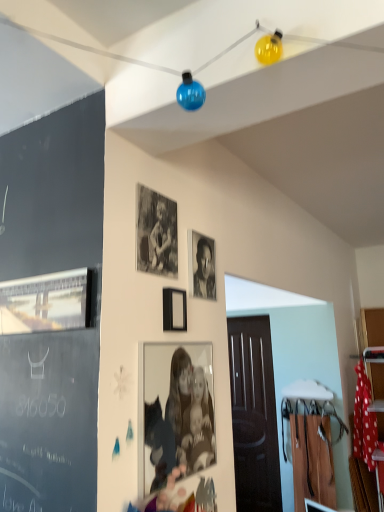
How much space does metallic silver picture frame at left, which is the first picture frame in left-to-right order, occupy horizontally?

1.21 inches.

Locate an element on the screen. metallic silver picture frame at left, which appears as the fourth picture frame when viewed from the right is located at coordinates (46, 302).

What do you see at coordinates (174, 310) in the screenshot? This screenshot has height=512, width=384. I see `black matte picture frame at center, positioned as the 3th picture frame in top-to-bottom order` at bounding box center [174, 310].

This screenshot has height=512, width=384. What are the coordinates of `metallic silver picture frame at left, acting as the 3th picture frame starting from the bottom` in the screenshot? It's located at (46, 302).

Is black and white photograph at center closer to the viewer compared to metallic silver picture frame at left, acting as the 3th picture frame starting from the bottom?

No, it is not.

Is black and white photograph at center oriented towards metallic silver picture frame at left, which appears as the fourth picture frame when viewed from the right?

No, black and white photograph at center is not facing towards metallic silver picture frame at left, which appears as the fourth picture frame when viewed from the right.

From a real-world perspective, is black and white photograph at center beneath metallic silver picture frame at left, acting as the 3th picture frame starting from the bottom?

No, from a real-world perspective, black and white photograph at center is not under metallic silver picture frame at left, acting as the 3th picture frame starting from the bottom.

Considering the positions of point (206, 287) and point (9, 306), is point (206, 287) closer or farther from the camera than point (9, 306)?

Point (206, 287) is positioned farther from the camera compared to point (9, 306).

Can you tell me how much black matte picture frame at center, positioned as the 3th picture frame in top-to-bottom order, and matte black photo frame at center, the first picture frame in the bottom-to-top sequence, differ in facing direction?

0.817 degrees.

Which is more to the right, black matte picture frame at center, positioned as the 3th picture frame in top-to-bottom order, or matte black photo frame at center, the fourth picture frame in the top-to-bottom sequence?

matte black photo frame at center, the fourth picture frame in the top-to-bottom sequence, is more to the right.

Is black matte picture frame at center, positioned as the 3th picture frame in top-to-bottom order, in front of or behind matte black photo frame at center, which appears as the fourth picture frame when viewed from the left, in the image?

black matte picture frame at center, positioned as the 3th picture frame in top-to-bottom order, is positioned farther from the viewer than matte black photo frame at center, which appears as the fourth picture frame when viewed from the left.

Considering the points (180, 430) and (176, 307), which point is behind, point (180, 430) or point (176, 307)?

The point (176, 307) is more distant.

Measure the distance between matte black photo frame at center, which appears as the fourth picture frame when viewed from the left, and black matte picture frame at center, positioned as the second picture frame in bottom-to-top order.

matte black photo frame at center, which appears as the fourth picture frame when viewed from the left, is 11.56 inches from black matte picture frame at center, positioned as the second picture frame in bottom-to-top order.

From the image's perspective, relative to black matte picture frame at center, positioned as the second picture frame in bottom-to-top order, is matte black photo frame at center, acting as the first picture frame starting from the right, above or below?

Based on their image positions, matte black photo frame at center, acting as the first picture frame starting from the right, is located beneath black matte picture frame at center, positioned as the second picture frame in bottom-to-top order.

Is black matte photo frame at upper center, which ranks as the third picture frame in right-to-left order, to the right of black matte picture frame at center, which is the 3th picture frame in left-to-right order, from the viewer's perspective?

No, black matte photo frame at upper center, which ranks as the third picture frame in right-to-left order, is not to the right of black matte picture frame at center, which is the 3th picture frame in left-to-right order.

Relative to black matte picture frame at center, positioned as the second picture frame in bottom-to-top order, is black matte photo frame at upper center, which is counted as the 2th picture frame, starting from the left, in front or behind?

black matte photo frame at upper center, which is counted as the 2th picture frame, starting from the left, is positioned closer to the viewer than black matte picture frame at center, positioned as the second picture frame in bottom-to-top order.

Is black matte photo frame at upper center, which ranks as the third picture frame in right-to-left order, not inside black matte picture frame at center, which is the 3th picture frame in left-to-right order?

Yes, black matte photo frame at upper center, which ranks as the third picture frame in right-to-left order, is located beyond the bounds of black matte picture frame at center, which is the 3th picture frame in left-to-right order.

From a real-world perspective, is black matte photo frame at upper center, which is the 4th picture frame from bottom to top, over black matte picture frame at center, which ranks as the second picture frame in right-to-left order?

Yes.

Considering the sizes of objects matte black photo frame at center, the fourth picture frame in the top-to-bottom sequence, and black matte photo frame at upper center, which is the 4th picture frame from bottom to top, in the image provided, who is bigger, matte black photo frame at center, the fourth picture frame in the top-to-bottom sequence, or black matte photo frame at upper center, which is the 4th picture frame from bottom to top,?

matte black photo frame at center, the fourth picture frame in the top-to-bottom sequence.

From the matte black photo frame at center, acting as the first picture frame starting from the right, count 1st picture frames backward and point to it. Please provide its 2D coordinates.

[(156, 233)]

Looking at this image, relative to black matte photo frame at upper center, which ranks as the third picture frame in right-to-left order, is matte black photo frame at center, which appears as the fourth picture frame when viewed from the left, in front or behind?

matte black photo frame at center, which appears as the fourth picture frame when viewed from the left, is in front of black matte photo frame at upper center, which ranks as the third picture frame in right-to-left order.

Is matte black photo frame at center, acting as the first picture frame starting from the right, positioned with its back to metallic silver picture frame at left, which is the first picture frame in left-to-right order?

matte black photo frame at center, acting as the first picture frame starting from the right, does not have its back to metallic silver picture frame at left, which is the first picture frame in left-to-right order.

Can metallic silver picture frame at left, acting as the 3th picture frame starting from the bottom, be found inside matte black photo frame at center, acting as the first picture frame starting from the right?

That's incorrect, metallic silver picture frame at left, acting as the 3th picture frame starting from the bottom, is not inside matte black photo frame at center, acting as the first picture frame starting from the right.

From the image's perspective, is matte black photo frame at center, the first picture frame in the bottom-to-top sequence, above metallic silver picture frame at left, which is the first picture frame in left-to-right order?

Incorrect, from the image's perspective, matte black photo frame at center, the first picture frame in the bottom-to-top sequence, is lower than metallic silver picture frame at left, which is the first picture frame in left-to-right order.

How many degrees apart are the facing directions of matte black photo frame at center, the first picture frame in the bottom-to-top sequence, and metallic silver picture frame at left, which appears as the fourth picture frame when viewed from the right?

The angular difference between matte black photo frame at center, the first picture frame in the bottom-to-top sequence, and metallic silver picture frame at left, which appears as the fourth picture frame when viewed from the right, is 90.6 degrees.

How different are the orientations of black and white photograph at center and black matte photo frame at upper center, the 1th picture frame viewed from the top, in degrees?

0.965 degrees.

Which object is wider, black and white photograph at center or black matte photo frame at upper center, which ranks as the third picture frame in right-to-left order?

Wider between the two is black and white photograph at center.

Which is farther from the camera, (206, 268) or (172, 250)?

The point (206, 268) is farther.

Where is `person directly beneath the black matte photo frame at upper center, which ranks as the third picture frame in right-to-left order (from a real-world perspective)`? The image size is (384, 512). person directly beneath the black matte photo frame at upper center, which ranks as the third picture frame in right-to-left order (from a real-world perspective) is located at coordinates (204, 271).

There is a black and white photograph at center. Identify the location of the 1st picture frame below it (from the image's perspective). Image resolution: width=384 pixels, height=512 pixels. (46, 302).

The width and height of the screenshot is (384, 512). Identify the location of picture frame that is the 1st object located above the matte black photo frame at center, acting as the first picture frame starting from the right (from the image's perspective). (174, 310).

In the scene shown: From the image, which object appears to be nearer to black matte photo frame at upper center, which is the 4th picture frame from bottom to top, black and white photograph at center or black matte picture frame at center, which is the 3th picture frame in left-to-right order?

black matte picture frame at center, which is the 3th picture frame in left-to-right order, lies closer to black matte photo frame at upper center, which is the 4th picture frame from bottom to top, than the other object.

Looking at the image, which one is located further to matte black photo frame at center, the first picture frame in the bottom-to-top sequence, black matte picture frame at center, which ranks as the second picture frame in right-to-left order, or metallic silver picture frame at left, which is the 2th picture frame in top-to-bottom order?

Among the two, metallic silver picture frame at left, which is the 2th picture frame in top-to-bottom order, is located further to matte black photo frame at center, the first picture frame in the bottom-to-top sequence.

Estimate the real-world distances between objects in this image. Which object is further from black matte photo frame at upper center, which ranks as the third picture frame in right-to-left order, black matte picture frame at center, which is the 3th picture frame in left-to-right order, or black and white photograph at center?

Based on the image, black and white photograph at center appears to be further to black matte photo frame at upper center, which ranks as the third picture frame in right-to-left order.

From the image, which object appears to be nearer to black matte photo frame at upper center, which is counted as the 2th picture frame, starting from the left, metallic silver picture frame at left, acting as the 3th picture frame starting from the bottom, or black and white photograph at center?

Among the two, black and white photograph at center is located nearer to black matte photo frame at upper center, which is counted as the 2th picture frame, starting from the left.

From the picture: When comparing their distances from black matte picture frame at center, positioned as the second picture frame in bottom-to-top order, does matte black photo frame at center, acting as the first picture frame starting from the right, or metallic silver picture frame at left, which is the first picture frame in left-to-right order, seem further?

The object further to black matte picture frame at center, positioned as the second picture frame in bottom-to-top order, is metallic silver picture frame at left, which is the first picture frame in left-to-right order.

When comparing their distances from black matte picture frame at center, positioned as the 3th picture frame in top-to-bottom order, does metallic silver picture frame at left, which appears as the fourth picture frame when viewed from the right, or black and white photograph at center seem further?

metallic silver picture frame at left, which appears as the fourth picture frame when viewed from the right, is positioned further to the anchor black matte picture frame at center, positioned as the 3th picture frame in top-to-bottom order.

Estimate the real-world distances between objects in this image. Which object is further from matte black photo frame at center, acting as the first picture frame starting from the right, black matte picture frame at center, which ranks as the second picture frame in right-to-left order, or black and white photograph at center?

black and white photograph at center is positioned further to the anchor matte black photo frame at center, acting as the first picture frame starting from the right.

Looking at the image, which one is located further to black and white photograph at center, black matte picture frame at center, positioned as the second picture frame in bottom-to-top order, or black matte photo frame at upper center, which is the 4th picture frame from bottom to top?

Among the two, black matte photo frame at upper center, which is the 4th picture frame from bottom to top, is located further to black and white photograph at center.

Locate an element on the screen. picture frame between metallic silver picture frame at left, which is the 2th picture frame in top-to-bottom order, and black matte picture frame at center, positioned as the second picture frame in bottom-to-top order, in the horizontal direction is located at coordinates (156, 233).

The image size is (384, 512). Identify the location of person between black matte photo frame at upper center, which is counted as the 2th picture frame, starting from the left, and black matte picture frame at center, which ranks as the second picture frame in right-to-left order, in the vertical direction. (204, 271).

At what (x,y) coordinates should I click in order to perform the action: click on person between black matte photo frame at upper center, which is the 4th picture frame from bottom to top, and matte black photo frame at center, the fourth picture frame in the top-to-bottom sequence, vertically. Please return your answer as a coordinate pair (x, y). The image size is (384, 512). Looking at the image, I should click on (204, 271).